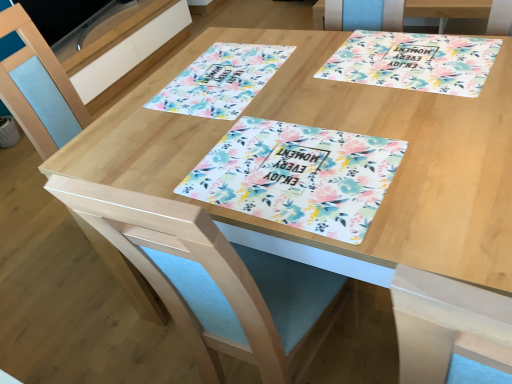
What are the coordinates of `free space below floral paper placemat at upper center, which is the 2th flyer in bottom-to-top order (from a real-world perspective)` in the screenshot? It's located at (220, 76).